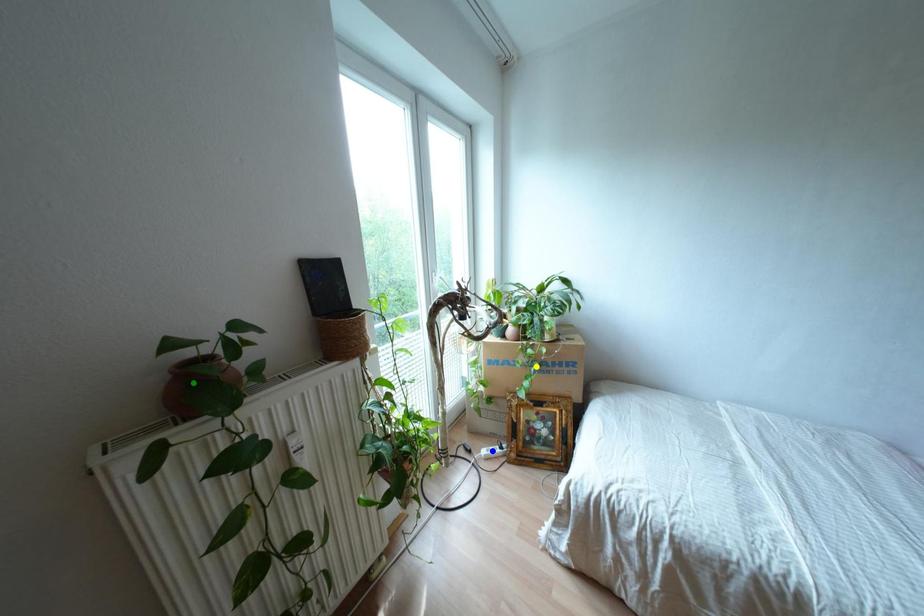
Order these from nearest to farthest:
yellow point | blue point | green point

green point → yellow point → blue point